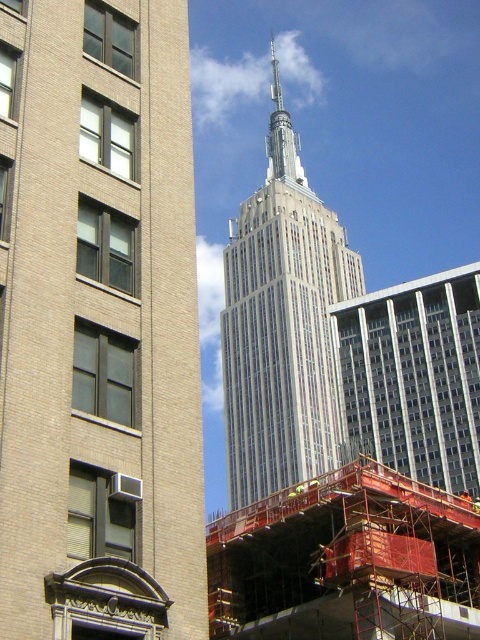
Question: Which object is positioned closest to the white glass skyscraper at center?

Choices:
 (A) silver metallic spire at center
 (B) white glass tower at center

Answer: (B)

Question: Which is farther from the white glass tower at center?

Choices:
 (A) white glass skyscraper at center
 (B) silver metallic spire at center

Answer: (A)

Question: Is white glass tower at center bigger than silver metallic spire at center?

Choices:
 (A) yes
 (B) no

Answer: (A)

Question: Is white glass tower at center positioned before silver metallic spire at center?

Choices:
 (A) no
 (B) yes

Answer: (B)

Question: Does white glass skyscraper at center appear on the right side of silver metallic spire at center?

Choices:
 (A) no
 (B) yes

Answer: (A)

Question: Which object is the closest to the silver metallic spire at center?

Choices:
 (A) white glass skyscraper at center
 (B) white glass tower at center

Answer: (B)